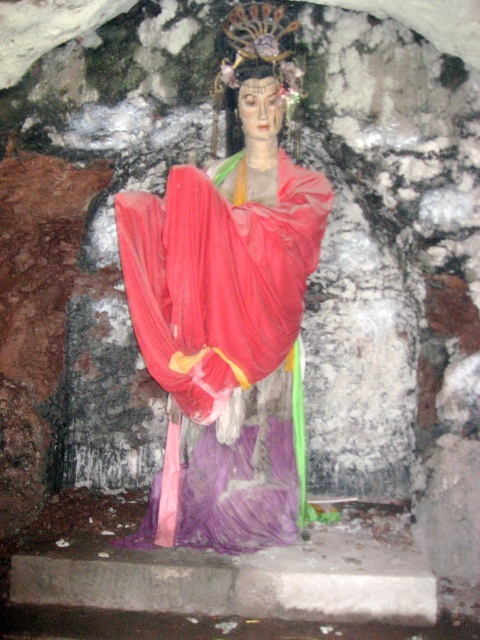
Question: Among these objects, which one is nearest to the camera?

Choices:
 (A) matte gold head at center
 (B) matte red silk robe at center

Answer: (B)

Question: Among these points, which one is farthest from the camera?

Choices:
 (A) (211, 212)
 (B) (283, 76)

Answer: (B)

Question: Is matte red silk robe at center positioned in front of matte gold head at center?

Choices:
 (A) no
 (B) yes

Answer: (B)

Question: In this image, where is matte red silk robe at center located relative to matte gold head at center?

Choices:
 (A) above
 (B) below

Answer: (B)

Question: Does matte red silk robe at center appear over matte gold head at center?

Choices:
 (A) no
 (B) yes

Answer: (A)